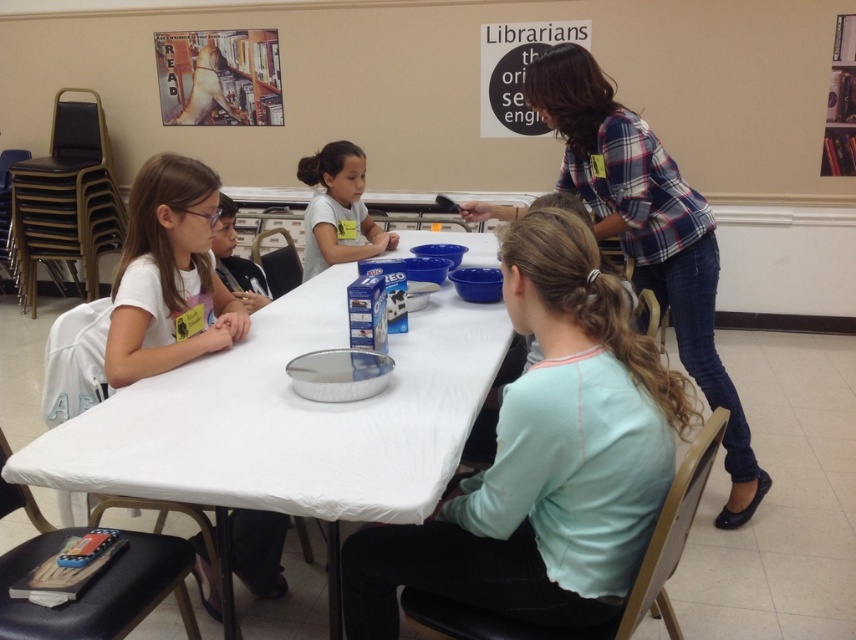
Question: Which object is closer to the camera taking this photo?

Choices:
 (A) light blue shirt at center
 (B) light blue fabric shirt at center
 (C) metallic silver dog at upper left

Answer: (B)

Question: Does white paper table at center have a larger size compared to light blue shirt at center?

Choices:
 (A) no
 (B) yes

Answer: (B)

Question: Which of the following is the closest to the observer?

Choices:
 (A) plaid shirt at upper right
 (B) light blue fabric shirt at center
 (C) white paper table at center
 (D) light blue shirt at center

Answer: (B)

Question: Based on their relative distances, which object is farther from the white paper table at center?

Choices:
 (A) light blue shirt at center
 (B) light blue fabric shirt at center
 (C) plaid shirt at upper right
 (D) white matte shirt at left

Answer: (C)

Question: Does white matte shirt at left have a greater width compared to light blue shirt at center?

Choices:
 (A) no
 (B) yes

Answer: (A)

Question: In this image, where is light blue fabric shirt at center located relative to white matte shirt at left?

Choices:
 (A) left
 (B) right

Answer: (B)